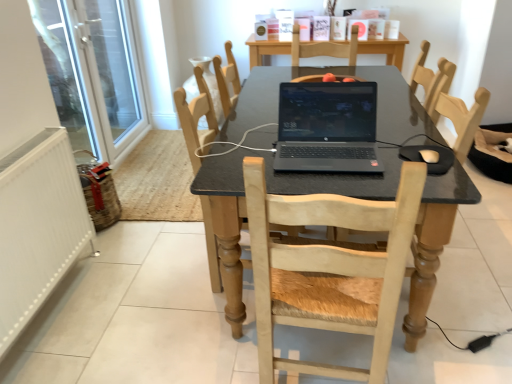
You are a GUI agent. You are given a task and a screenshot of the screen. Output one action in this format:
    pyautogui.click(x=<x>, y=<y>)
    Task: Click on the free space in front of light wood chair at center, which ranks as the second chair in front-to-back order
    The height and width of the screenshot is (384, 512).
    Given the screenshot: What is the action you would take?
    pyautogui.click(x=211, y=335)